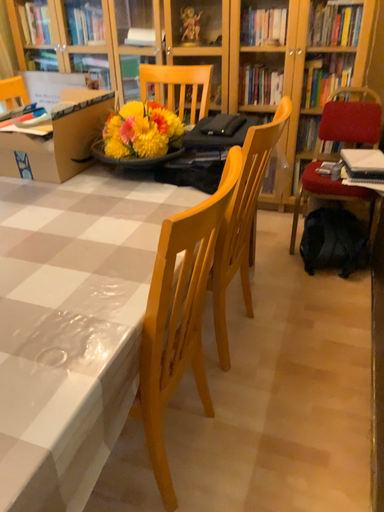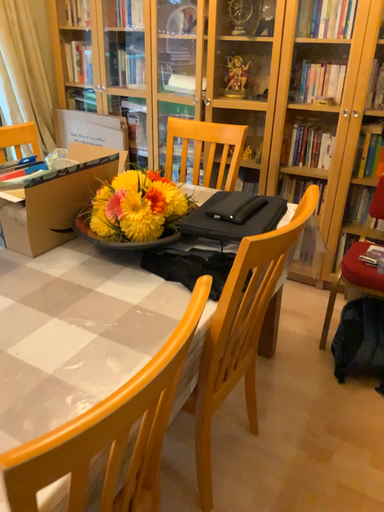
Question: How did the camera likely rotate when shooting the video?

Choices:
 (A) rotated right
 (B) rotated left

Answer: (B)